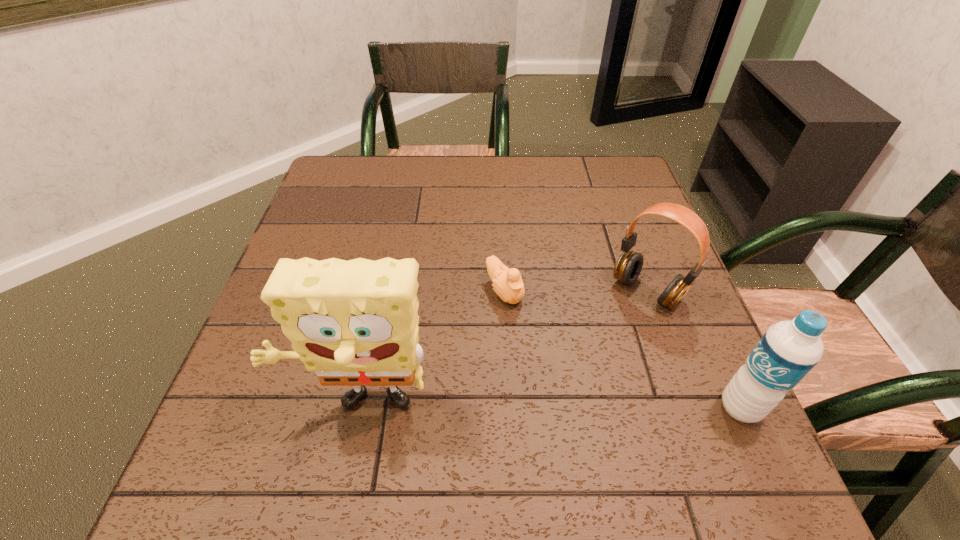
The height and width of the screenshot is (540, 960). Identify the location of blank space located on the face of the third object from right to left. (579, 388).

Find the location of a particular element. vacant region located 0.220m on the face of the third object from right to left is located at coordinates (579, 388).

Identify the location of free space located 0.260m on the ear cups of the second shortest object. (557, 389).

You are a GUI agent. You are given a task and a screenshot of the screen. Output one action in this format:
    pyautogui.click(x=<x>, y=<y>)
    Task: Click on the vacant space situated 0.260m on the ear cups of the second shortest object
    Image resolution: width=960 pixels, height=540 pixels.
    Given the screenshot: What is the action you would take?
    pyautogui.click(x=557, y=389)

You are a GUI agent. You are given a task and a screenshot of the screen. Output one action in this format:
    pyautogui.click(x=<x>, y=<y>)
    Task: Click on the vacant space located 0.170m on the ear cups of the second shortest object
    
    Given the screenshot: What is the action you would take?
    pyautogui.click(x=585, y=359)

Find the location of a particular element. The width and height of the screenshot is (960, 540). sponge that is at the near edge is located at coordinates (355, 323).

This screenshot has height=540, width=960. Identify the location of water bottle that is at the near edge. (786, 353).

At what (x,y) coordinates should I click in order to perform the action: click on object that is at the left edge. Please return your answer as a coordinate pair (x, y). The height and width of the screenshot is (540, 960). Looking at the image, I should click on (355, 323).

The width and height of the screenshot is (960, 540). I want to click on water bottle positioned at the right edge, so click(x=786, y=353).

The image size is (960, 540). What are the coordinates of `headset that is at the right edge` in the screenshot? It's located at (628, 266).